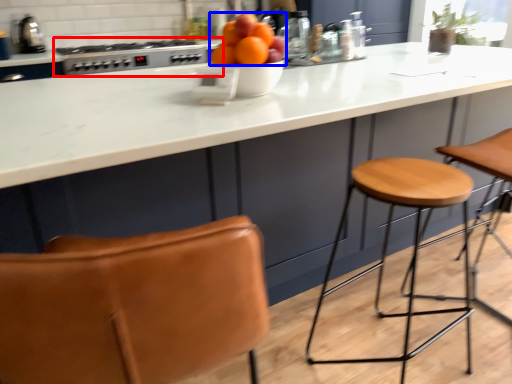
Question: Among these objects, which one is farthest to the camera, gas stove (highlighted by a red box) or orange (highlighted by a blue box)?

Choices:
 (A) gas stove
 (B) orange

Answer: (A)